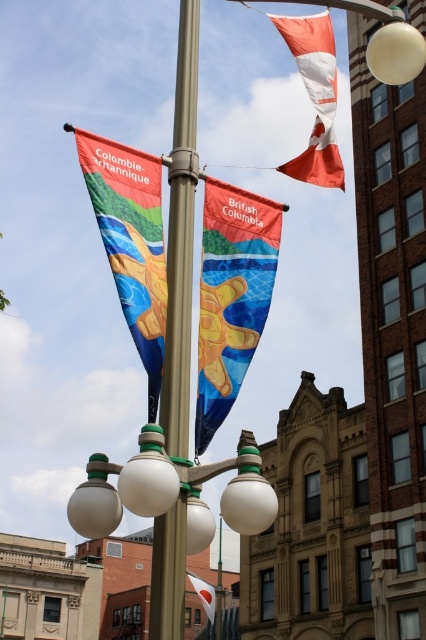
Between metallic pole at center and white fabric flag at lower center, which one is positioned higher?

metallic pole at center is above.

Who is more forward, (184, 188) or (195, 582)?

Point (184, 188)

In order to click on metallic pole at center in this screenshot , I will do `click(181, 241)`.

Is metallic pole at center to the right of white glossy street light at center from the viewer's perspective?

Yes, metallic pole at center is to the right of white glossy street light at center.

Is point (184, 131) farther from viewer compared to point (92, 513)?

That is True.

Locate an element on the screen. The width and height of the screenshot is (426, 640). metallic pole at center is located at coordinates (181, 241).

Looking at this image, is matte fabric flag at upper left to the right of orange fabric flag at upper right from the viewer's perspective?

In fact, matte fabric flag at upper left is to the left of orange fabric flag at upper right.

Between point (161, 256) and point (331, 51), which one is positioned behind?

Point (331, 51)

Find the location of a particular element. This screenshot has width=426, height=640. matte fabric flag at upper left is located at coordinates (131, 241).